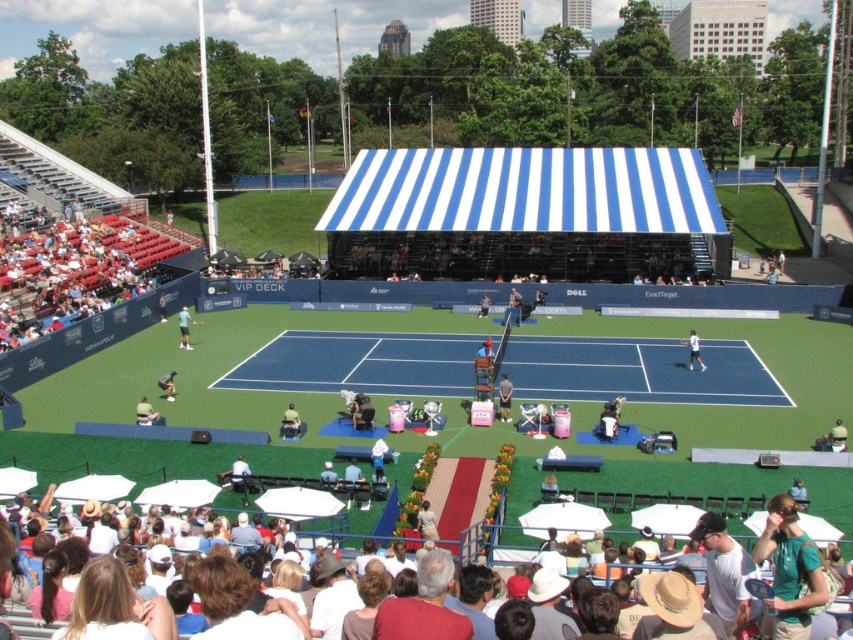
Can you confirm if blue synthetic turf tennis court at center is bigger than light brown leather tennis racket at center?

Indeed, blue synthetic turf tennis court at center has a larger size compared to light brown leather tennis racket at center.

Does blue synthetic turf tennis court at center appear on the left side of light brown leather tennis racket at center?

In fact, blue synthetic turf tennis court at center is to the right of light brown leather tennis racket at center.

Is point (711, 396) less distant than point (505, 408)?

No.

The image size is (853, 640). I want to click on blue synthetic turf tennis court at center, so click(637, 371).

Does white tennis racket at center have a lesser width compared to white fabric tennis racket at center?

In fact, white tennis racket at center might be wider than white fabric tennis racket at center.

Measure the distance between point (190, 316) and camera.

Point (190, 316) is 49.08 meters from camera.

Identify the location of white tennis racket at center. Image resolution: width=853 pixels, height=640 pixels. (184, 326).

What do you see at coordinates (503, 397) in the screenshot? The image size is (853, 640). I see `light brown leather tennis racket at center` at bounding box center [503, 397].

Is light brown leather tennis racket at center closer to the viewer compared to green fabric umbrella at lower right?

That is False.

The height and width of the screenshot is (640, 853). Identify the location of light brown leather tennis racket at center. tap(503, 397).